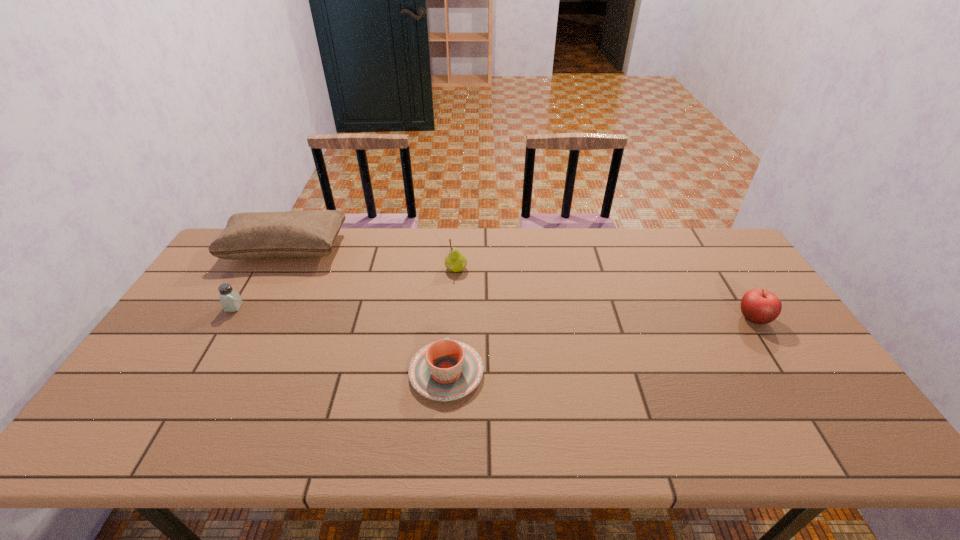
Locate an element on the screen. empty location between the apple and the nearest object is located at coordinates (600, 346).

Identify the location of free point between the pear and the cushion. The width and height of the screenshot is (960, 540). (371, 259).

Find the location of `free space between the saltshaker and the pear`. free space between the saltshaker and the pear is located at coordinates (346, 288).

Select which object is the closest to the chinaware. Please provide its 2D coordinates. Your answer should be formatted as a tuple, i.e. [(x, y)], where the tuple contains the x and y coordinates of a point satisfying the conditions above.

[(455, 261)]

Locate an element on the screen. object that stands as the third closest to the apple is located at coordinates point(251,235).

The width and height of the screenshot is (960, 540). I want to click on blank area in the image that satisfies the following two spatial constraints: 1. on the handle side of the chinaware; 2. on the right side of the apple, so click(x=450, y=319).